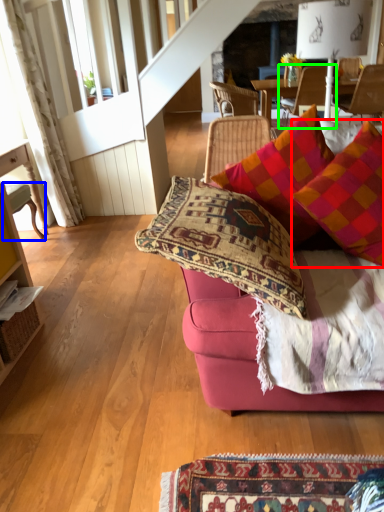
Question: Estimate the real-world distances between objects in this image. Which object is farther from pillow (highlighted by a red box), chair (highlighted by a blue box) or chair (highlighted by a green box)?

Choices:
 (A) chair
 (B) chair

Answer: (B)